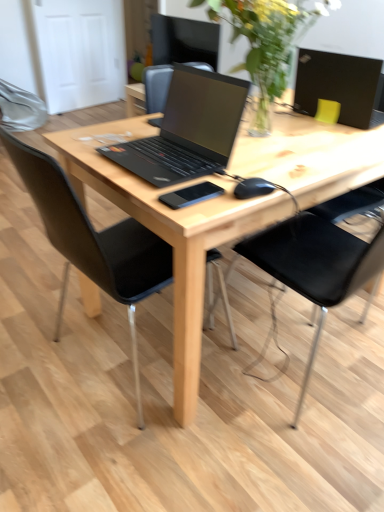
Find the location of a particular element. This screenshot has height=512, width=384. vacant area to the right of black matte phone at center is located at coordinates (250, 176).